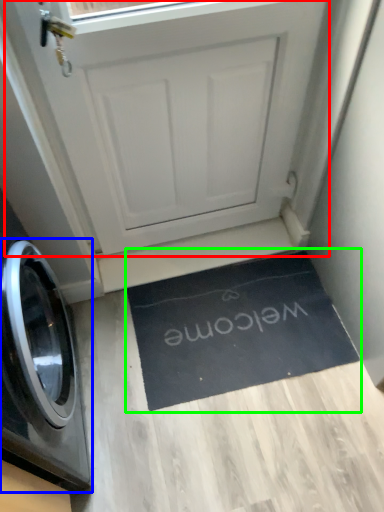
Question: Estimate the real-world distances between objects in this image. Which object is closer to screen door (highlighted by a red box), washing machine (highlighted by a blue box) or doormat (highlighted by a green box)?

Choices:
 (A) washing machine
 (B) doormat

Answer: (B)